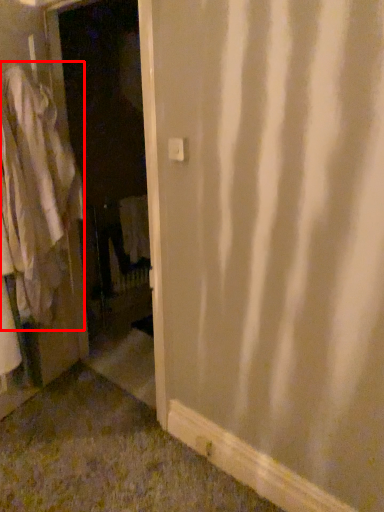
Question: From the image, what is the correct spatial relationship of clothing (annotated by the red box) in relation to screen door?

Choices:
 (A) right
 (B) left

Answer: (B)